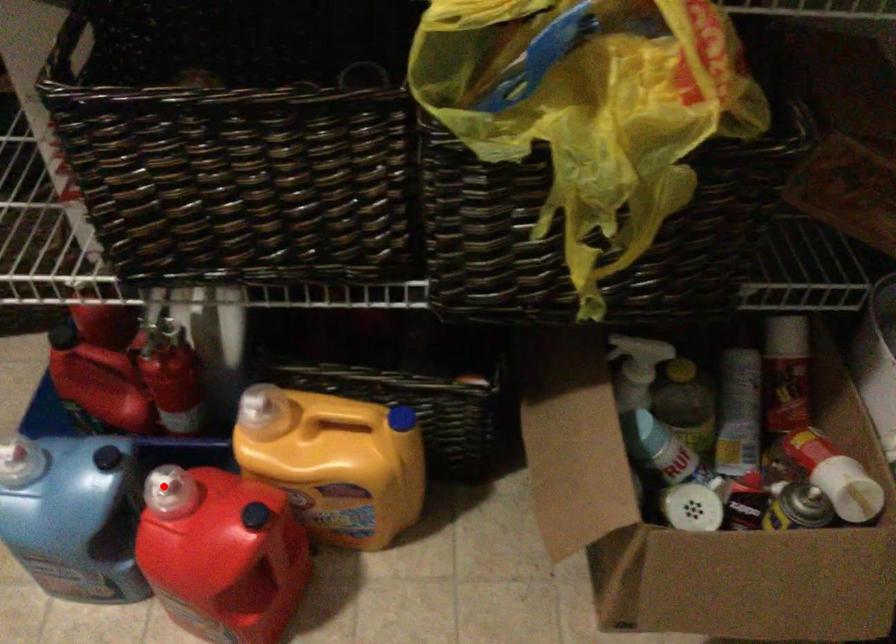
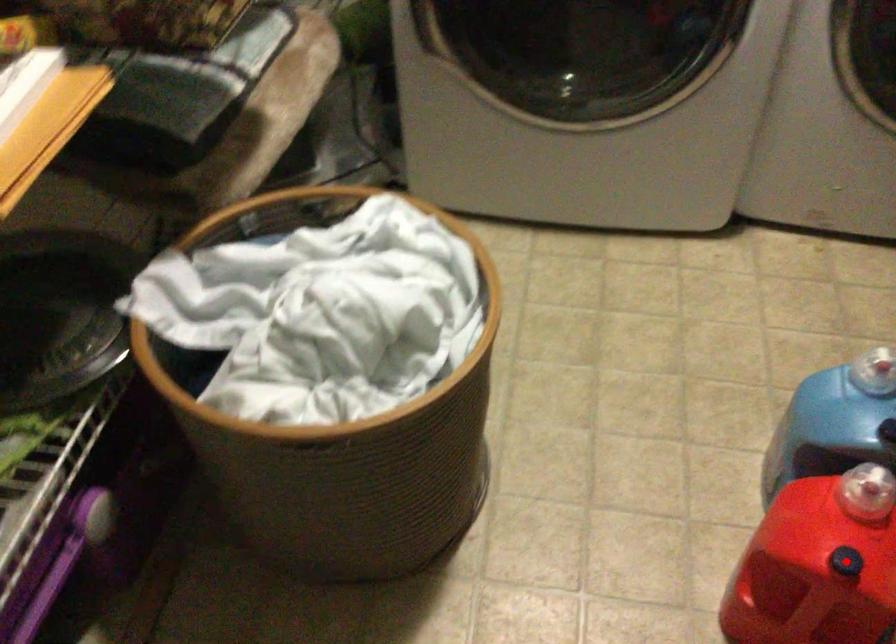
I am providing you with two images of the same scene from different viewpoints. A red point is marked on the first image and another point is marked on the second image. Does the point marked in image1 correspond to the same location as the one in image2?

No